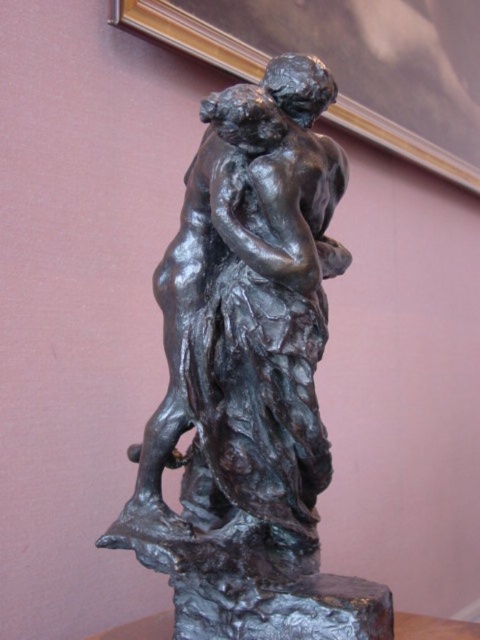
Question: Can you confirm if bronze statue at center is thinner than gold-framed picture at upper center?

Choices:
 (A) no
 (B) yes

Answer: (B)

Question: Can you confirm if bronze statue at center is positioned to the left of gold-framed picture at upper center?

Choices:
 (A) yes
 (B) no

Answer: (A)

Question: From the image, what is the correct spatial relationship of bronze statue at center in relation to gold-framed picture at upper center?

Choices:
 (A) below
 (B) above

Answer: (A)